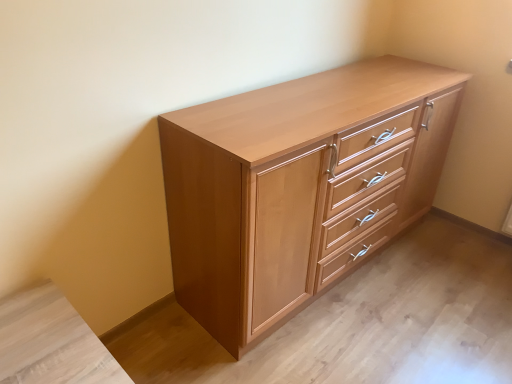
I want to click on vacant space to the right of light brown wood chest of drawers at center, so click(x=445, y=276).